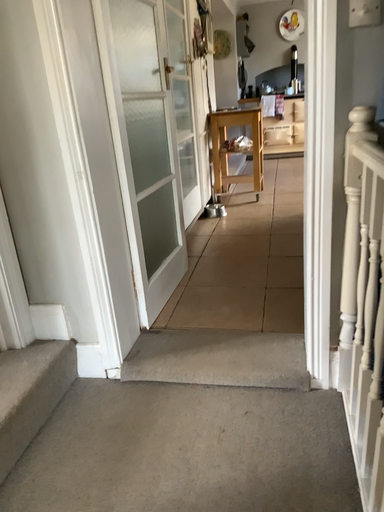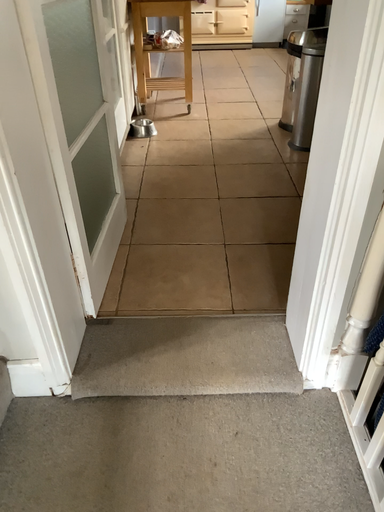
Question: How did the camera likely rotate when shooting the video?

Choices:
 (A) rotated left
 (B) rotated right

Answer: (B)